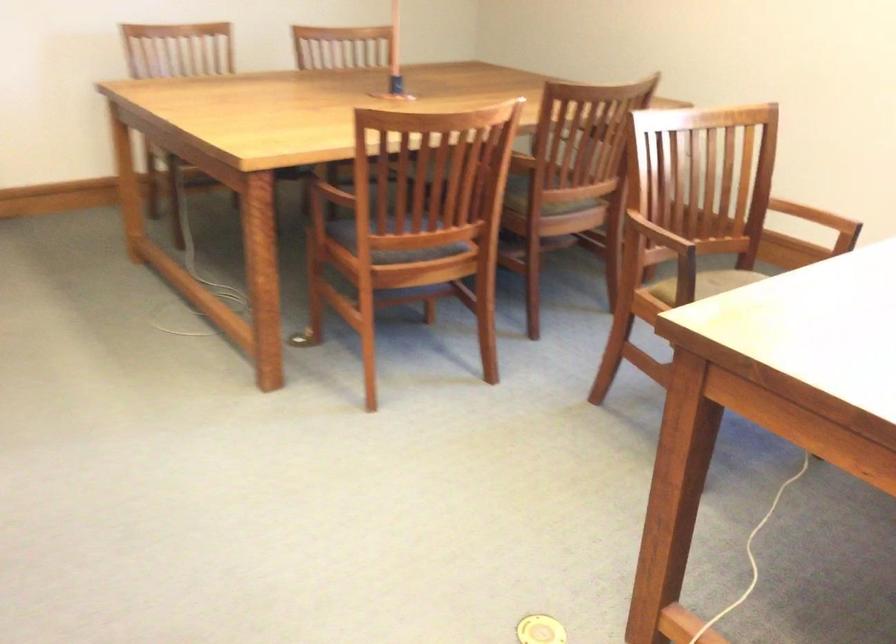
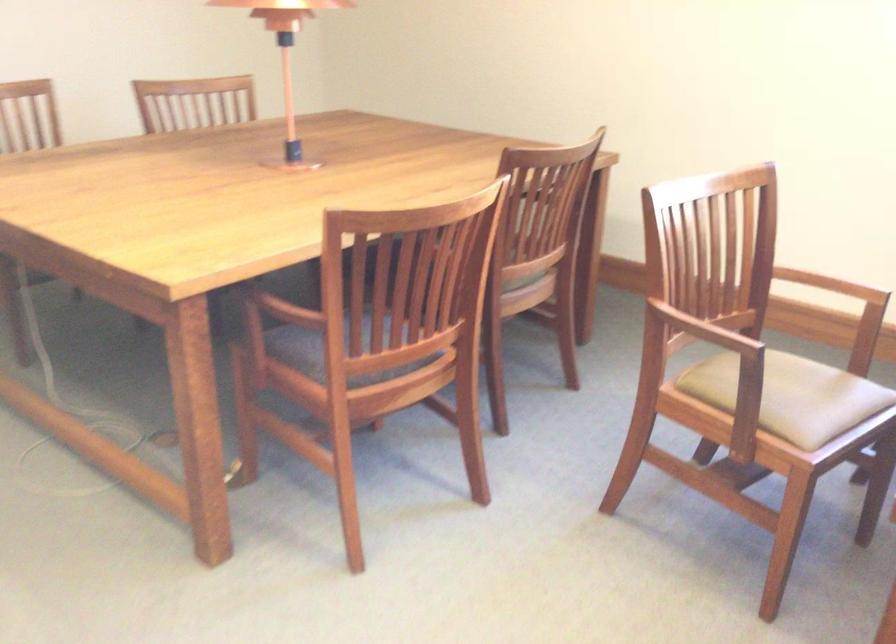
Find the pixel in the second image that matches (x=391, y=214) in the first image.

(366, 330)